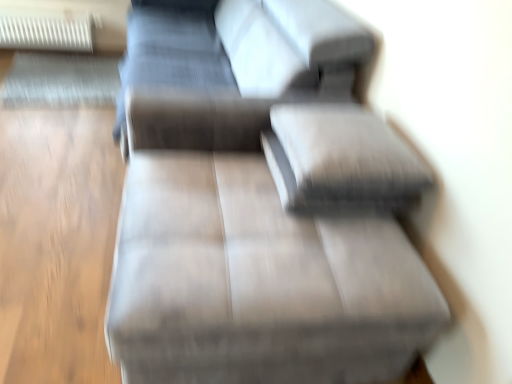
Question: In the image, is matte gray couch at center positioned in front of or behind white plastic radiator at upper left?

Choices:
 (A) behind
 (B) front

Answer: (B)

Question: From their relative heights in the image, would you say matte gray couch at center is taller or shorter than white plastic radiator at upper left?

Choices:
 (A) tall
 (B) short

Answer: (A)

Question: Which object is the closest to the textured gray pillow at center?

Choices:
 (A) white plastic radiator at upper left
 (B) suede-like gray couch at center
 (C) matte gray couch at center

Answer: (B)

Question: Considering the real-world distances, which object is farthest from the white plastic radiator at upper left?

Choices:
 (A) matte gray couch at center
 (B) textured gray pillow at center
 (C) suede-like gray couch at center

Answer: (B)